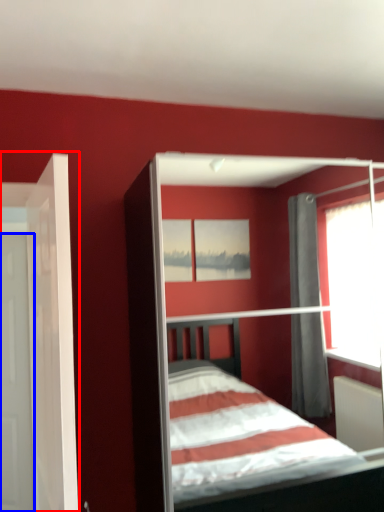
Question: Which of the following is the farthest to the observer, door (highlighted by a red box) or door (highlighted by a blue box)?

Choices:
 (A) door
 (B) door

Answer: (B)